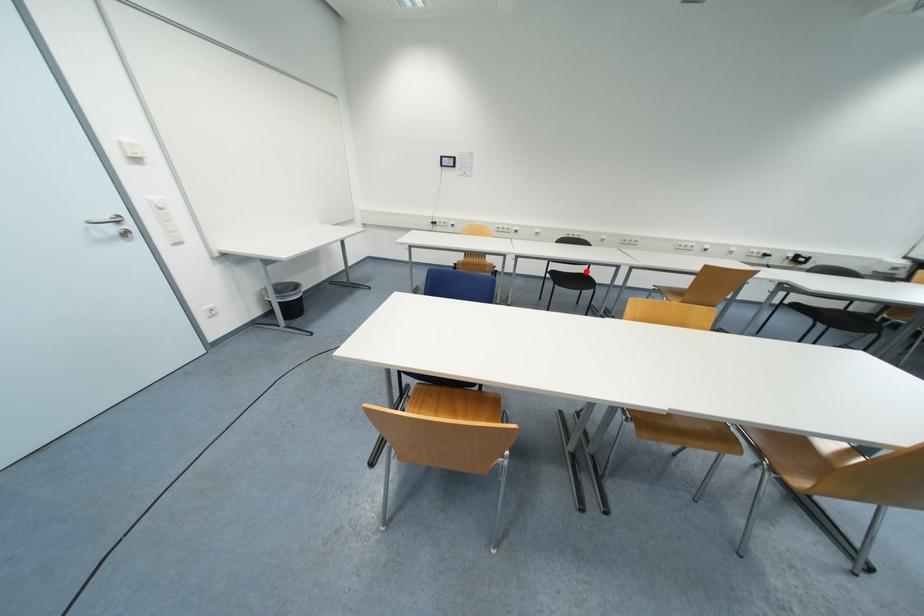
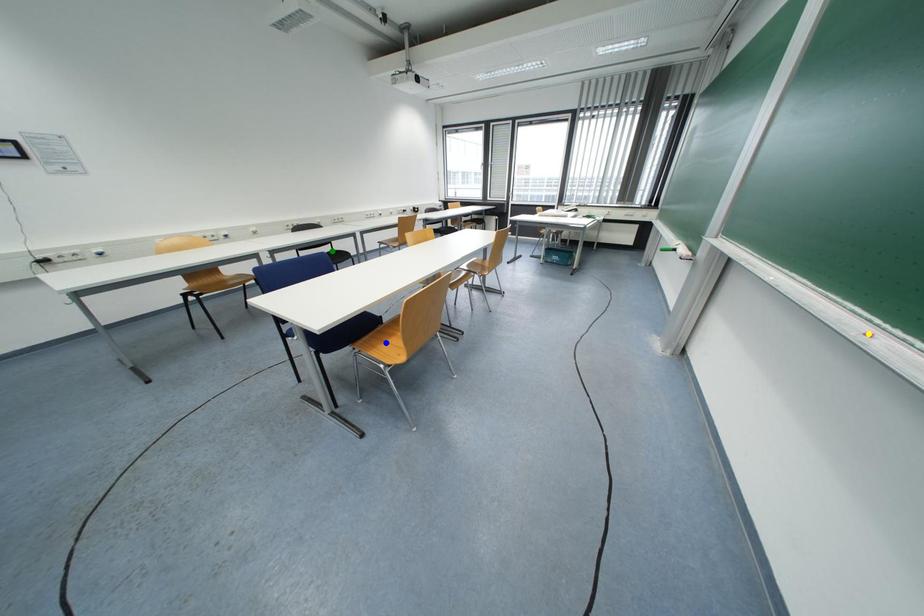
Question: I am providing you with two images of the same scene from different viewpoints. A red point is marked on the first image. You are given multiple points on the second image. Which spot in image 2 lines up with the point in image 1?

Choices:
 (A) yellow point
 (B) green point
 (C) blue point

Answer: (B)